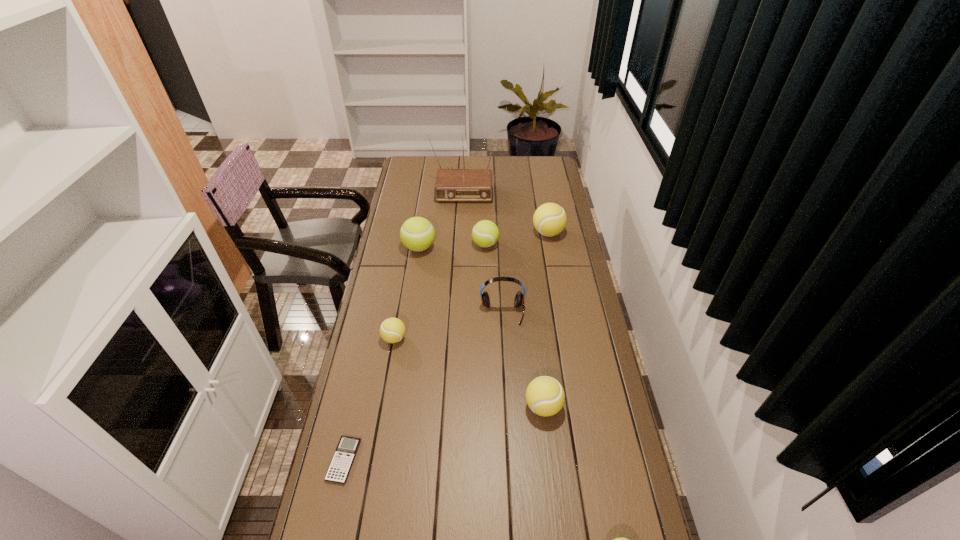
The image size is (960, 540). I want to click on free space that is in between the fourth tennis ball from right to left and the biggest yellow tennis ball, so click(516, 239).

Where is `free space between the fifth farthest object and the fourth nearest object`? The image size is (960, 540). free space between the fifth farthest object and the fourth nearest object is located at coordinates (448, 326).

The image size is (960, 540). Identify the location of vacant point located between the fifth farthest tennis ball and the third tennis ball from left to right. (515, 326).

Where is `vacant area that lies between the second nearest yellow tennis ball and the tallest object`? The height and width of the screenshot is (540, 960). vacant area that lies between the second nearest yellow tennis ball and the tallest object is located at coordinates (429, 261).

In order to click on unoccupied position between the leftmost green tennis ball and the third nearest object in this screenshot , I will do tap(481, 327).

Identify the location of vacant area that lies between the nearest yellow tennis ball and the fourth tennis ball from right to left. (515, 326).

Locate an element on the screen. This screenshot has width=960, height=540. free space between the calculator and the second smallest yellow tennis ball is located at coordinates (444, 433).

Find the location of a particular element. free area in between the smallest yellow tennis ball and the red headset is located at coordinates (448, 326).

Locate which object ranks in proximity to the shortest object. Please provide its 2D coordinates. Your answer should be formatted as a tuple, i.e. [(x, y)], where the tuple contains the x and y coordinates of a point satisfying the conditions above.

[(392, 330)]

The height and width of the screenshot is (540, 960). I want to click on object that stands as the fifth closest to the farthest yellow tennis ball, so click(x=392, y=330).